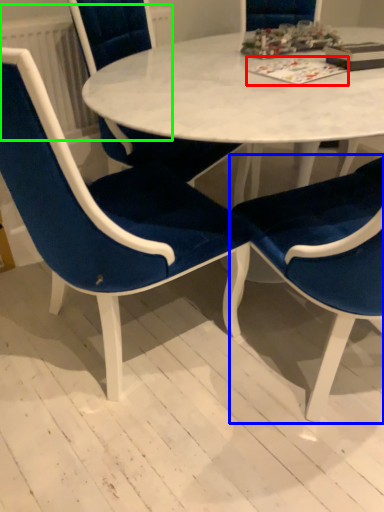
Question: Estimate the real-world distances between objects in this image. Which object is closer to book (highlighted by a red box), chair (highlighted by a blue box) or radiator (highlighted by a green box)?

Choices:
 (A) chair
 (B) radiator

Answer: (A)